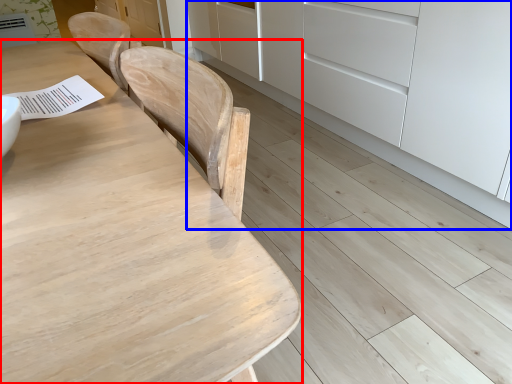
Question: Which object is closer to the camera taking this photo, table (highlighted by a red box) or cabinetry (highlighted by a blue box)?

Choices:
 (A) table
 (B) cabinetry

Answer: (A)